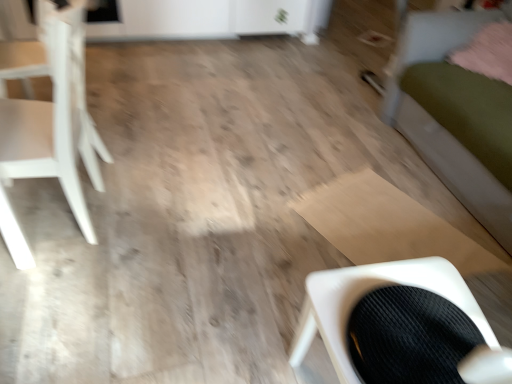
Question: Is the position of pink fluffy pillow at upper right less distant than that of black corduroy chair at lower right, which is the second chair in left-to-right order?

Choices:
 (A) yes
 (B) no

Answer: (B)

Question: Can we say pink fluffy pillow at upper right lies outside black corduroy chair at lower right, which is the second chair in left-to-right order?

Choices:
 (A) no
 (B) yes

Answer: (B)

Question: From a real-world perspective, is pink fluffy pillow at upper right over black corduroy chair at lower right, acting as the 1th chair starting from the bottom?

Choices:
 (A) no
 (B) yes

Answer: (B)

Question: Does pink fluffy pillow at upper right appear on the left side of black corduroy chair at lower right, which is the second chair in left-to-right order?

Choices:
 (A) yes
 (B) no

Answer: (B)

Question: From the image's perspective, is pink fluffy pillow at upper right on black corduroy chair at lower right, which is the second chair in left-to-right order?

Choices:
 (A) no
 (B) yes

Answer: (B)

Question: Is green fabric bed at right wider or thinner than white matte chair at left, acting as the 2th chair starting from the right?

Choices:
 (A) wide
 (B) thin

Answer: (A)

Question: Visually, is green fabric bed at right positioned to the left or to the right of white matte chair at left, which appears as the first chair when viewed from the top?

Choices:
 (A) left
 (B) right

Answer: (B)

Question: Choose the correct answer: Is green fabric bed at right inside white matte chair at left, which appears as the first chair when viewed from the top, or outside it?

Choices:
 (A) outside
 (B) inside

Answer: (A)

Question: Does point (429, 44) appear closer or farther from the camera than point (86, 129)?

Choices:
 (A) closer
 (B) farther

Answer: (B)

Question: Choose the correct answer: Is pink fluffy pillow at upper right inside white matte chair at left, which appears as the first chair when viewed from the top, or outside it?

Choices:
 (A) inside
 (B) outside

Answer: (B)

Question: Is pink fluffy pillow at upper right wider or thinner than white matte chair at left, placed as the first chair when sorted from left to right?

Choices:
 (A) wide
 (B) thin

Answer: (B)

Question: From a real-world perspective, is pink fluffy pillow at upper right above or below white matte chair at left, which appears as the first chair when viewed from the top?

Choices:
 (A) above
 (B) below

Answer: (A)

Question: Is pink fluffy pillow at upper right in front of or behind white matte chair at left, which appears as the first chair when viewed from the top, in the image?

Choices:
 (A) front
 (B) behind

Answer: (B)

Question: From a real-world perspective, relative to black corduroy chair at lower right, which is the second chair in left-to-right order, is white matte chair at left, placed as the first chair when sorted from left to right, vertically above or below?

Choices:
 (A) above
 (B) below

Answer: (B)

Question: From the image's perspective, is white matte chair at left, which appears as the first chair when viewed from the top, positioned above or below black corduroy chair at lower right, which is the second chair in left-to-right order?

Choices:
 (A) above
 (B) below

Answer: (A)